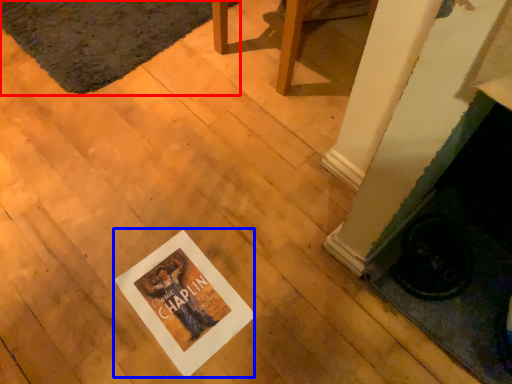
Question: Which point is further to the camera, mat (highlighted by a red box) or postcard (highlighted by a blue box)?

Choices:
 (A) mat
 (B) postcard

Answer: (A)